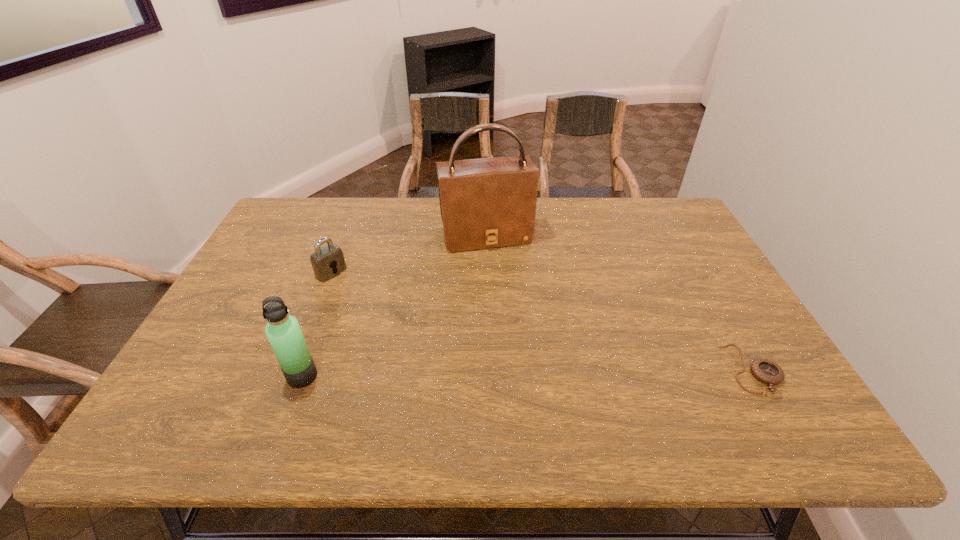
Locate an element on the screen. vacant region at the far edge of the desktop is located at coordinates (377, 207).

At what (x,y) coordinates should I click in order to perform the action: click on vacant position at the near edge of the desktop. Please return your answer as a coordinate pair (x, y). The image size is (960, 540). Looking at the image, I should click on (667, 366).

This screenshot has width=960, height=540. What are the coordinates of `vacant space at the left edge of the desktop` in the screenshot? It's located at (234, 361).

In the image, there is a desktop. Identify the location of vacant space at the right edge. (715, 336).

The height and width of the screenshot is (540, 960). In the image, there is a desktop. Identify the location of free region at the far left corner. (318, 204).

At what (x,y) coordinates should I click in order to perform the action: click on free space at the far right corner of the desktop. Please return your answer as a coordinate pair (x, y). Looking at the image, I should click on (685, 234).

This screenshot has width=960, height=540. In order to click on unoccupied area between the second tallest object and the third tallest object in this screenshot , I will do `click(317, 324)`.

You are a GUI agent. You are given a task and a screenshot of the screen. Output one action in this format:
    pyautogui.click(x=<x>, y=<y>)
    Task: Click on the free space between the thermos bottle and the third nearest object
    The height and width of the screenshot is (540, 960).
    Given the screenshot: What is the action you would take?
    pyautogui.click(x=317, y=324)

Locate an element on the screen. This screenshot has height=540, width=960. unoccupied area between the second farthest object and the thermos bottle is located at coordinates (317, 324).

Where is `vacant area that lies between the third tallest object and the pocket watch`? The image size is (960, 540). vacant area that lies between the third tallest object and the pocket watch is located at coordinates (542, 321).